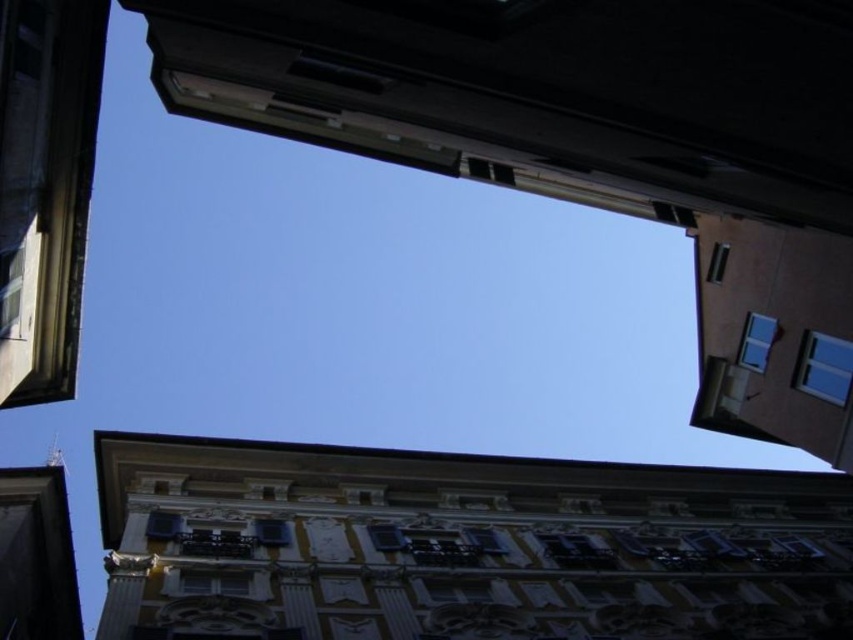
Question: Considering the real-world distances, which object is closest to the metallic silver window at upper right?

Choices:
 (A) matte black window at lower center
 (B) matte white window at center
 (C) transparent glass window at upper right

Answer: (C)

Question: Is transparent glass window at upper right below matte white window at center?

Choices:
 (A) yes
 (B) no

Answer: (B)

Question: From the image, what is the correct spatial relationship of clear glass window at upper right in relation to metallic silver window at upper right?

Choices:
 (A) right
 (B) left

Answer: (A)

Question: Can you confirm if white textured building at center is positioned above transparent glass window at upper right?

Choices:
 (A) yes
 (B) no

Answer: (B)

Question: Which object is farther from the camera taking this photo?

Choices:
 (A) metallic silver window at upper right
 (B) matte black window at lower center

Answer: (A)

Question: Estimate the real-world distances between objects in this image. Which object is farther from the matte black window at lower center?

Choices:
 (A) metallic silver window at upper right
 (B) matte white window at center

Answer: (A)